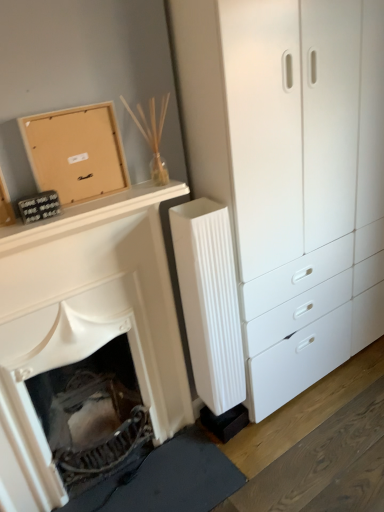
Question: Is white matte fireplace at lower left outside matte brown cardboard at upper left?

Choices:
 (A) no
 (B) yes

Answer: (B)

Question: Considering the relative positions of white matte fireplace at lower left and matte brown cardboard at upper left in the image provided, is white matte fireplace at lower left to the right of matte brown cardboard at upper left from the viewer's perspective?

Choices:
 (A) no
 (B) yes

Answer: (A)

Question: Considering the relative sizes of white matte fireplace at lower left and matte brown cardboard at upper left in the image provided, is white matte fireplace at lower left bigger than matte brown cardboard at upper left?

Choices:
 (A) no
 (B) yes

Answer: (B)

Question: Considering the relative sizes of white matte fireplace at lower left and matte brown cardboard at upper left in the image provided, is white matte fireplace at lower left shorter than matte brown cardboard at upper left?

Choices:
 (A) no
 (B) yes

Answer: (A)

Question: Are white matte fireplace at lower left and matte brown cardboard at upper left far apart?

Choices:
 (A) yes
 (B) no

Answer: (B)

Question: Is matte brown cardboard at upper left inside the boundaries of white ribbed radiator at center, or outside?

Choices:
 (A) inside
 (B) outside

Answer: (B)

Question: Is matte brown cardboard at upper left taller or shorter than white ribbed radiator at center?

Choices:
 (A) tall
 (B) short

Answer: (B)

Question: Does point (x=61, y=138) appear closer or farther from the camera than point (x=200, y=336)?

Choices:
 (A) farther
 (B) closer

Answer: (B)

Question: Looking at the image, does matte brown cardboard at upper left seem bigger or smaller compared to white ribbed radiator at center?

Choices:
 (A) big
 (B) small

Answer: (B)

Question: From the image's perspective, is white matte fireplace at lower left positioned above or below white plastic chest of drawers at center-right?

Choices:
 (A) below
 (B) above

Answer: (A)

Question: In terms of height, does white matte fireplace at lower left look taller or shorter compared to white plastic chest of drawers at center-right?

Choices:
 (A) tall
 (B) short

Answer: (B)

Question: Is white matte fireplace at lower left to the left or to the right of white plastic chest of drawers at center-right in the image?

Choices:
 (A) left
 (B) right

Answer: (A)

Question: In terms of width, does white matte fireplace at lower left look wider or thinner when compared to white plastic chest of drawers at center-right?

Choices:
 (A) thin
 (B) wide

Answer: (A)

Question: Visually, is white matte fireplace at lower left positioned to the left or to the right of white ribbed radiator at center?

Choices:
 (A) left
 (B) right

Answer: (A)

Question: Does point (61, 308) appear closer or farther from the camera than point (206, 281)?

Choices:
 (A) closer
 (B) farther

Answer: (A)